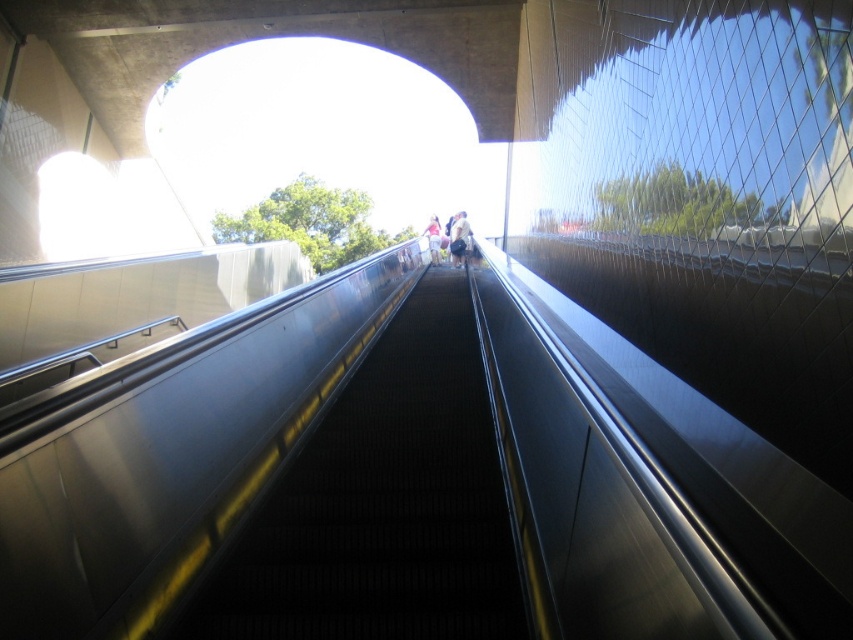
Question: Which point is closer to the camera?

Choices:
 (A) (426, 237)
 (B) (460, 212)
 (C) (308, 472)

Answer: (C)

Question: Is the position of black rubber stairs at center less distant than that of pink fabric at center?

Choices:
 (A) no
 (B) yes

Answer: (B)

Question: Which object appears closest to the camera in this image?

Choices:
 (A) pink fabric at center
 (B) light beige fabric bag at center

Answer: (B)

Question: Can you confirm if light beige fabric bag at center is positioned above pink fabric at center?

Choices:
 (A) yes
 (B) no

Answer: (B)

Question: Estimate the real-world distances between objects in this image. Which object is farther from the pink fabric at center?

Choices:
 (A) black rubber stairs at center
 (B) light beige fabric bag at center

Answer: (A)

Question: Is light beige fabric bag at center wider than pink fabric at center?

Choices:
 (A) yes
 (B) no

Answer: (B)